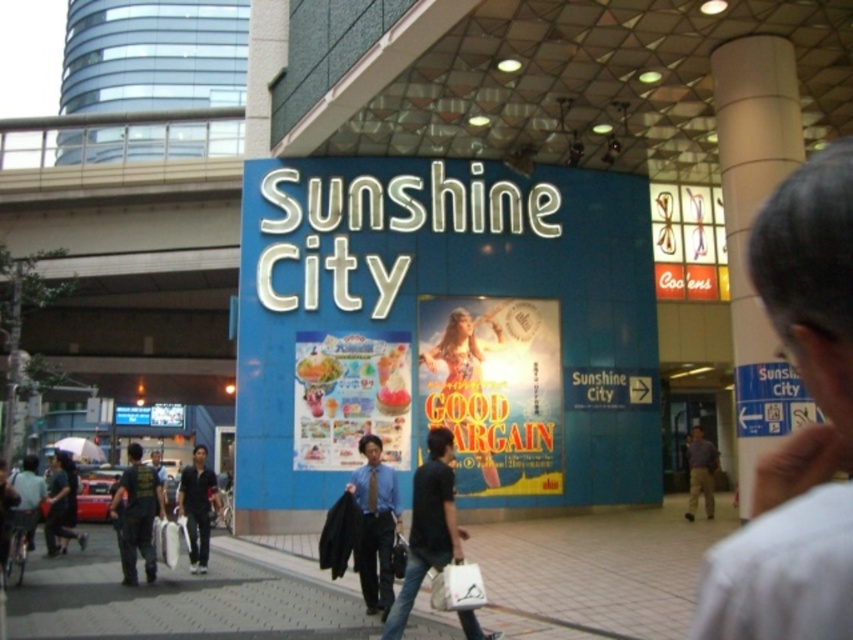
You are standing at the entrance of Sunshine City and see two men in the image. One is wearing a blue shirt and tie at center, and the other is wearing a dark blue shirt at center. Which man is positioned to the right side?

The blue shirt and tie at center is positioned to the right of dark blue shirt at center, so the man in the blue shirt and tie at center is on the right side.

Based on the photo, you are standing at the entrance of Sunshine City and notice two men wearing different colored shirts. The first man is wearing a blue shirt and tie at center, and the second is wearing a light brown shirt at center. Which man is shorter?

The blue shirt and tie at center is not as tall as light brown shirt at center, so the man wearing the blue shirt and tie at center is shorter.